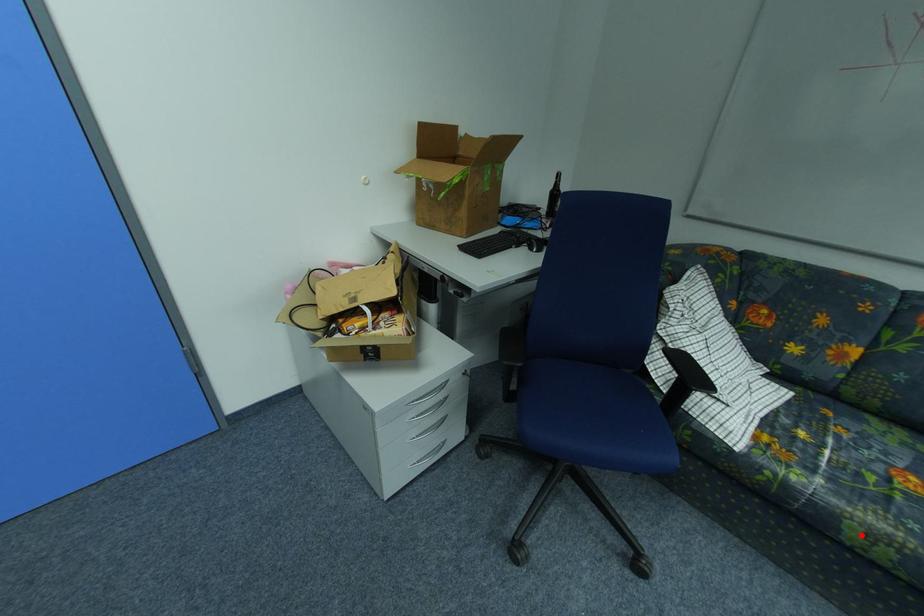
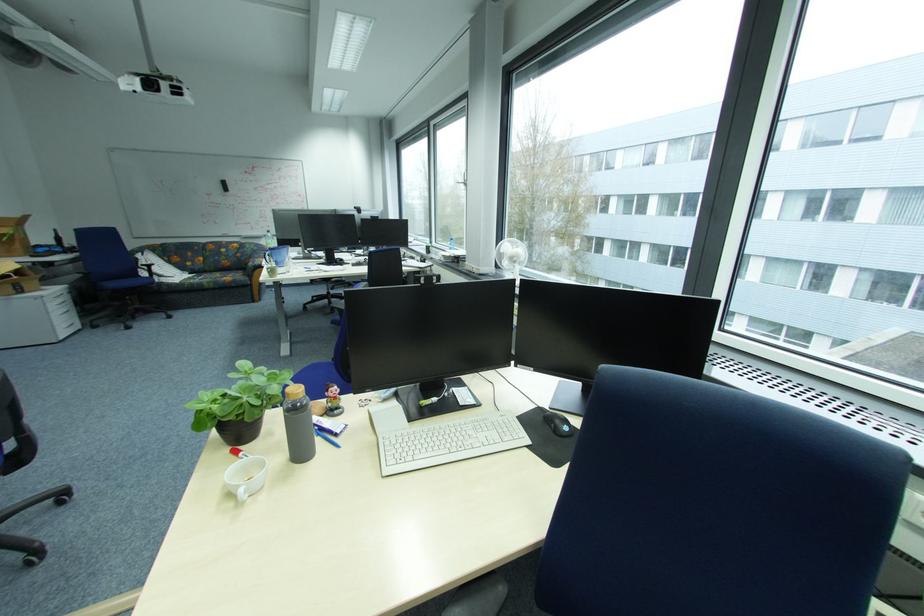
Find the pixel in the second image that matches the highlighted location in the first image.

(214, 286)